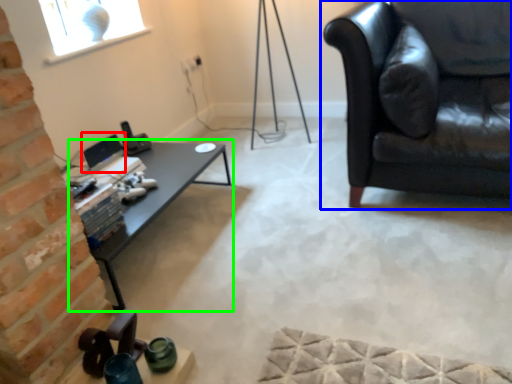
Question: Which object is the closest to the computer monitor (highlighted by a red box)? Choose among these: studio couch (highlighted by a blue box) or table (highlighted by a green box).

Choices:
 (A) studio couch
 (B) table

Answer: (B)